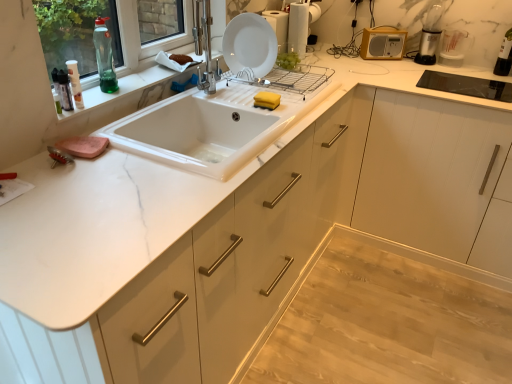
Question: Is white glossy plate at upper center to the left of marble window sill at upper left from the viewer's perspective?

Choices:
 (A) yes
 (B) no

Answer: (B)

Question: Is the depth of white glossy plate at upper center less than that of marble window sill at upper left?

Choices:
 (A) yes
 (B) no

Answer: (B)

Question: Is the surface of white glossy plate at upper center in direct contact with marble window sill at upper left?

Choices:
 (A) no
 (B) yes

Answer: (A)

Question: From a real-world perspective, is white glossy plate at upper center located higher than marble window sill at upper left?

Choices:
 (A) yes
 (B) no

Answer: (A)

Question: Is white glossy plate at upper center shorter than marble window sill at upper left?

Choices:
 (A) yes
 (B) no

Answer: (B)

Question: Is white glossy plate at upper center behind marble window sill at upper left?

Choices:
 (A) no
 (B) yes

Answer: (B)

Question: From the image's perspective, would you say transparent plastic measuring cup at upper right, the 2th appliance in the left-to-right sequence, is shown under translucent plastic spray bottle at upper left, which appears as the first bottle when viewed from the front?

Choices:
 (A) no
 (B) yes

Answer: (A)

Question: Is transparent plastic measuring cup at upper right, the 2th appliance in the left-to-right sequence, not close to translucent plastic spray bottle at upper left, the third bottle positioned from the right?

Choices:
 (A) yes
 (B) no

Answer: (A)

Question: Is transparent plastic measuring cup at upper right, which ranks as the first appliance in right-to-left order, at the right side of translucent plastic spray bottle at upper left, the third bottle positioned from the right?

Choices:
 (A) yes
 (B) no

Answer: (A)

Question: Can you confirm if transparent plastic measuring cup at upper right, which ranks as the first appliance in right-to-left order, is shorter than translucent plastic spray bottle at upper left, placed as the first bottle when sorted from bottom to top?

Choices:
 (A) yes
 (B) no

Answer: (B)

Question: Considering the relative sizes of transparent plastic measuring cup at upper right, the 2th appliance in the left-to-right sequence, and translucent plastic spray bottle at upper left, placed as the first bottle when sorted from bottom to top, in the image provided, is transparent plastic measuring cup at upper right, the 2th appliance in the left-to-right sequence, thinner than translucent plastic spray bottle at upper left, placed as the first bottle when sorted from bottom to top,?

Choices:
 (A) yes
 (B) no

Answer: (B)

Question: Considering the relative positions of transparent plastic measuring cup at upper right, the 2th appliance in the left-to-right sequence, and translucent plastic spray bottle at upper left, the third bottle positioned from the right, in the image provided, is transparent plastic measuring cup at upper right, the 2th appliance in the left-to-right sequence, in front of translucent plastic spray bottle at upper left, the third bottle positioned from the right,?

Choices:
 (A) no
 (B) yes

Answer: (A)

Question: Is yellow matte radio at upper right, the 1th appliance from the left, located within transparent plastic bottle at upper right, marked as the third bottle in a bottom-to-top arrangement?

Choices:
 (A) no
 (B) yes

Answer: (A)